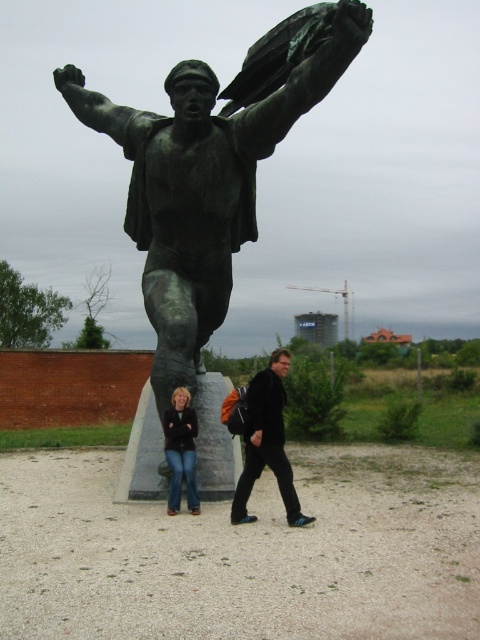
Question: Which point is farther to the camera?

Choices:
 (A) denim jeans at lower left
 (B) black matte jacket at center

Answer: (A)

Question: Which point is farther to the camera?

Choices:
 (A) denim jeans at lower left
 (B) black matte jacket at center
 (C) bronze statue at center

Answer: (A)

Question: Is bronze statue at center behind black matte jacket at center?

Choices:
 (A) no
 (B) yes

Answer: (B)

Question: Can you confirm if bronze statue at center is positioned above denim jeans at lower left?

Choices:
 (A) yes
 (B) no

Answer: (A)

Question: Where is bronze statue at center located in relation to denim jeans at lower left in the image?

Choices:
 (A) right
 (B) left

Answer: (B)

Question: Which point is farther to the camera?

Choices:
 (A) denim jeans at lower left
 (B) bronze statue at center
 (C) black matte jacket at center

Answer: (A)